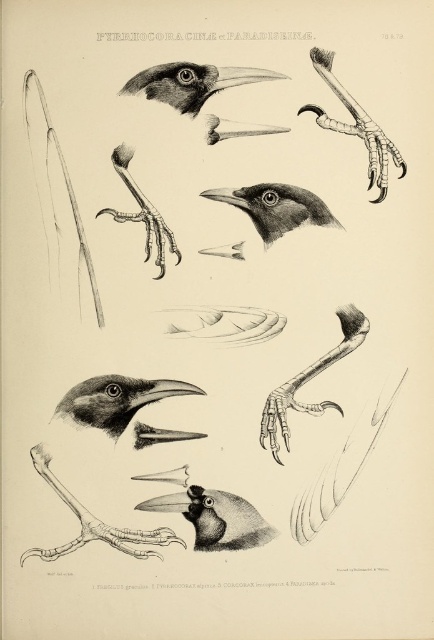
Does gray pencil sketch bird head at upper center lie in front of smooth gray claw at center?

Yes.

Who is more forward, (170, 544) or (262, 440)?

Point (170, 544) is more forward.

Is point (141, 547) positioned in front of point (306, 376)?

Yes, it is in front of point (306, 376).

Locate an element on the screen. This screenshot has height=640, width=434. gray pencil sketch bird head at upper center is located at coordinates (131, 474).

Which is behind, point (117, 428) or point (237, 132)?

Positioned behind is point (237, 132).

Who is more forward, (157,529) or (163,220)?

Point (157,529) is more forward.

Is point (88, 392) farther from camera compared to point (203, 100)?

Yes, it is.

The width and height of the screenshot is (434, 640). Identify the location of matte black beak at center. (115, 401).

Between smooth black beak at center and matte bone beak at upper center, which one appears on the right side from the viewer's perspective?

From the viewer's perspective, smooth black beak at center appears more on the right side.

Is point (282, 195) positioned behind point (278, 132)?

Yes.

Identify the location of smooth black beak at center. This screenshot has width=434, height=640. (276, 208).